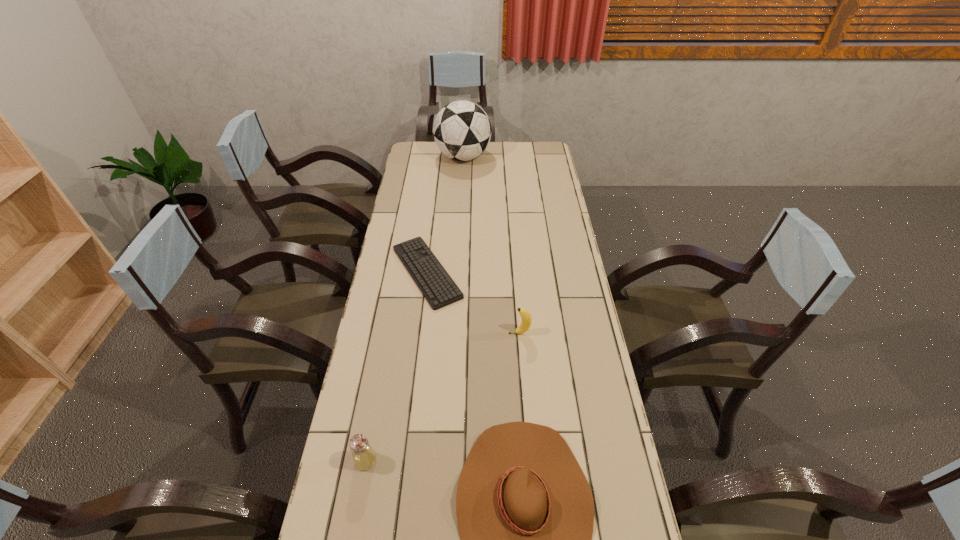
The image size is (960, 540). In order to click on vacant position located on the front of the saltshaker in this screenshot , I will do `click(355, 518)`.

Find the location of a particular element. This screenshot has width=960, height=540. vacant space located on the right of the computer keyboard is located at coordinates (508, 272).

The height and width of the screenshot is (540, 960). I want to click on object that is at the far edge, so click(462, 131).

Image resolution: width=960 pixels, height=540 pixels. I want to click on soccer ball that is positioned at the left edge, so click(x=462, y=131).

What are the coordinates of `saltshaker at the left edge` in the screenshot? It's located at (364, 457).

Where is `computer keyboard present at the left edge`? The image size is (960, 540). computer keyboard present at the left edge is located at coordinates (434, 282).

Find the location of `object situated at the far left corner`. object situated at the far left corner is located at coordinates (462, 131).

Image resolution: width=960 pixels, height=540 pixels. Identify the location of vacant space at the far edge. (487, 164).

Where is `vacant area at the left edge`? vacant area at the left edge is located at coordinates (386, 318).

Find the location of `free space at the right edge of the desktop`. free space at the right edge of the desktop is located at coordinates (553, 305).